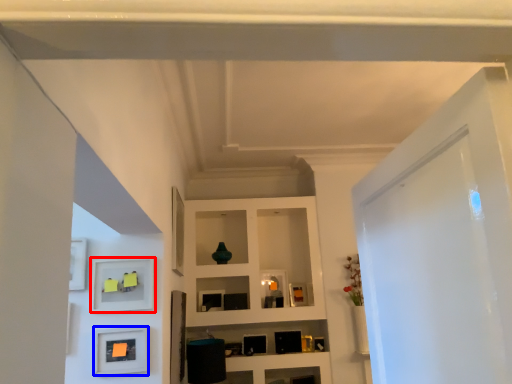
Question: Which of the following is the farthest to the observer, shelf (highlighted by a red box) or picture frame (highlighted by a blue box)?

Choices:
 (A) shelf
 (B) picture frame

Answer: (A)